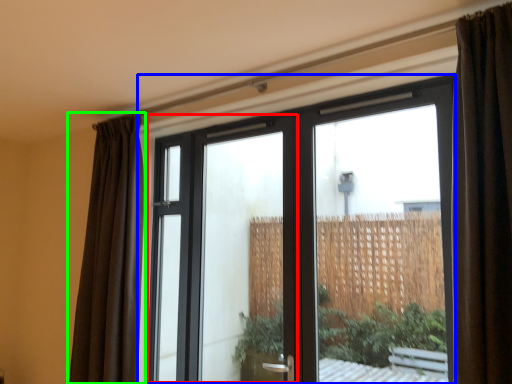
Question: Considering the real-world distances, which object is farthest from screen door (highlighted by a red box)? window (highlighted by a blue box) or curtain (highlighted by a green box)?

Choices:
 (A) window
 (B) curtain

Answer: (A)